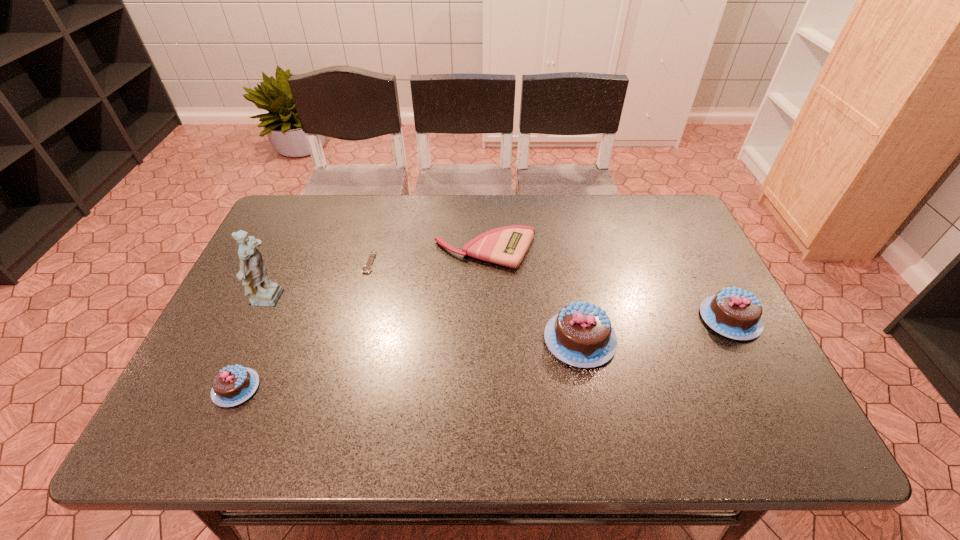
You are a GUI agent. You are given a task and a screenshot of the screen. Output one action in this format:
    pyautogui.click(x=<x>, y=<y>)
    Task: Click on the free space between the third object from left to right and the third shortest object
    The width and height of the screenshot is (960, 540).
    Given the screenshot: What is the action you would take?
    pyautogui.click(x=302, y=325)

Identify the location of free space between the third shortest object and the tallest object. (253, 345).

Image resolution: width=960 pixels, height=540 pixels. I want to click on empty space between the shortest chocolate cake and the rightmost object, so click(483, 353).

Identify the location of unoccupied area between the leftmost chocolate cake and the second chocolate cake from right to left. (408, 363).

Where is `free space that is in between the shortest object and the tallest object`? The image size is (960, 540). free space that is in between the shortest object and the tallest object is located at coordinates (320, 282).

Where is `object that is the second nearest to the figurine`? This screenshot has width=960, height=540. object that is the second nearest to the figurine is located at coordinates (367, 268).

Point out which object is positioned as the nearest to the rightmost chocolate cake. Please provide its 2D coordinates. Your answer should be formatted as a tuple, i.e. [(x, y)], where the tuple contains the x and y coordinates of a point satisfying the conditions above.

[(581, 335)]

This screenshot has height=540, width=960. In order to click on chocolate cake that is the second closest to the wristlet in this screenshot , I will do `click(734, 313)`.

Identify which chocolate cake is the second closest to the third object from left to right. Please provide its 2D coordinates. Your answer should be formatted as a tuple, i.e. [(x, y)], where the tuple contains the x and y coordinates of a point satisfying the conditions above.

[(581, 335)]

Where is `free space that satisfies the following two spatial constraints: 1. on the front-facing side of the second chocolate cake from right to left; 2. on the left side of the tallest object`? free space that satisfies the following two spatial constraints: 1. on the front-facing side of the second chocolate cake from right to left; 2. on the left side of the tallest object is located at coordinates 252,340.